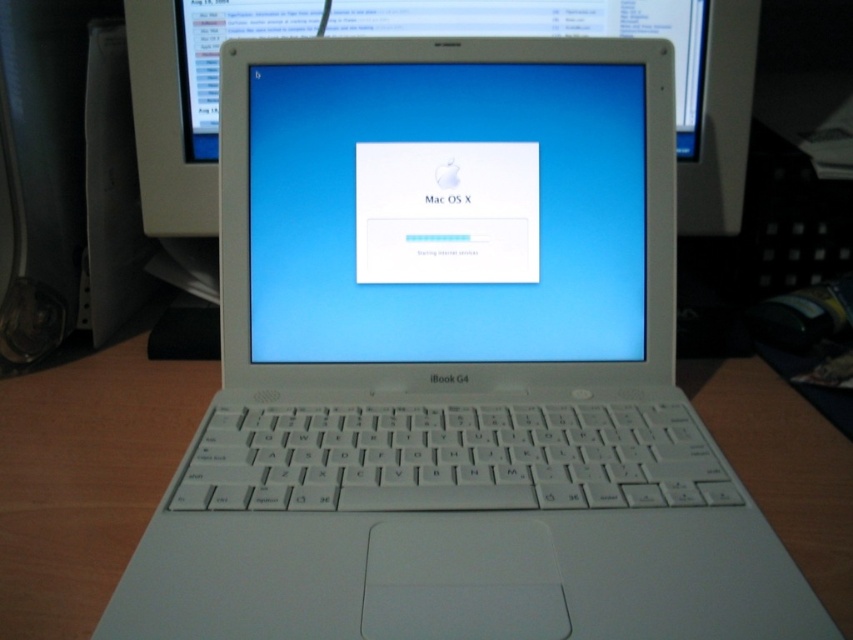
Between white glossy screen at center and white plastic keyboard at center, which one has less height?

white plastic keyboard at center is shorter.

At what (x,y) coordinates should I click in order to perform the action: click on white glossy screen at center. Please return your answer as a coordinate pair (x, y). Image resolution: width=853 pixels, height=640 pixels. Looking at the image, I should click on (445, 212).

Is point (325, 150) behind point (270, 493)?

Yes, it is behind point (270, 493).

Image resolution: width=853 pixels, height=640 pixels. I want to click on white glossy screen at center, so click(x=445, y=212).

Which is in front, point (467, 97) or point (732, 196)?

Point (467, 97) is in front.

Does white glossy screen at center come behind white plastic computer monitor at center?

No, white glossy screen at center is closer to the viewer.

Which is behind, point (459, 141) or point (209, 180)?

Positioned behind is point (209, 180).

Identify the location of white glossy screen at center. This screenshot has height=640, width=853. (445, 212).

Is point (804, 401) in front of point (328, 456)?

No, it is behind (328, 456).

Who is more distant from viewer, (109, 419) or (610, 435)?

The point (109, 419) is behind.

The width and height of the screenshot is (853, 640). What do you see at coordinates (86, 474) in the screenshot?
I see `wooden table at center` at bounding box center [86, 474].

Locate an element on the screen. wooden table at center is located at coordinates (86, 474).